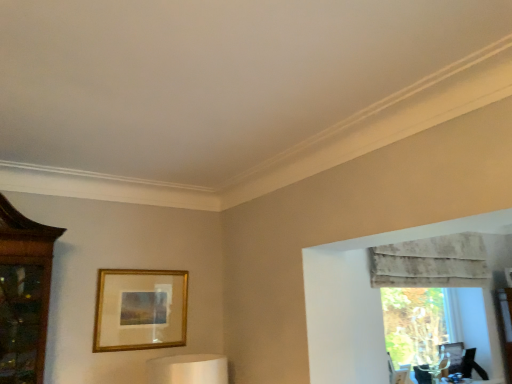
The image size is (512, 384). Describe the element at coordinates (140, 309) in the screenshot. I see `gold metallic picture frame at center` at that location.

The width and height of the screenshot is (512, 384). Describe the element at coordinates (413, 323) in the screenshot. I see `transparent glass vase at right` at that location.

Image resolution: width=512 pixels, height=384 pixels. What do you see at coordinates (431, 262) in the screenshot?
I see `textured beige curtain at upper right` at bounding box center [431, 262].

Locate an element on the screen. This screenshot has width=512, height=384. gold metallic picture frame at center is located at coordinates coord(140,309).

Looking at the image, does gold metallic picture frame at center seem bigger or smaller compared to textured beige curtain at upper right?

Considering their sizes, gold metallic picture frame at center takes up less space than textured beige curtain at upper right.

Looking at this image, is gold metallic picture frame at center aimed at textured beige curtain at upper right?

No, gold metallic picture frame at center is not aimed at textured beige curtain at upper right.

Can you confirm if transparent glass vase at right is positioned to the left of textured beige curtain at upper right?

Yes.

Is transparent glass vase at right turned away from textured beige curtain at upper right?

transparent glass vase at right is not turned away from textured beige curtain at upper right.

Between transparent glass vase at right and textured beige curtain at upper right, which one has more height?

With more height is transparent glass vase at right.

Is point (416, 264) more distant than point (115, 270)?

That is True.

From the image's perspective, is textured beige curtain at upper right beneath gold metallic picture frame at center?

No, from the image's perspective, textured beige curtain at upper right is not below gold metallic picture frame at center.

How many degrees apart are the facing directions of textured beige curtain at upper right and gold metallic picture frame at center?

1.25 degrees.

Considering the sizes of textured beige curtain at upper right and transparent glass vase at right in the image, is textured beige curtain at upper right taller or shorter than transparent glass vase at right?

Clearly, textured beige curtain at upper right is shorter compared to transparent glass vase at right.

Does textured beige curtain at upper right turn towards transparent glass vase at right?

No.

Consider the image. How different are the orientations of textured beige curtain at upper right and transparent glass vase at right in degrees?

The facing directions of textured beige curtain at upper right and transparent glass vase at right are 0.369 degrees apart.

In the scene shown: Considering the relative sizes of textured beige curtain at upper right and transparent glass vase at right in the image provided, is textured beige curtain at upper right smaller than transparent glass vase at right?

No.

Between point (401, 305) and point (181, 320), which one is positioned in front?

The point (181, 320) is closer to the camera.

From a real-world perspective, is transparent glass vase at right under gold metallic picture frame at center?

Yes, from a real-world perspective, transparent glass vase at right is below gold metallic picture frame at center.

Who is shorter, transparent glass vase at right or gold metallic picture frame at center?

gold metallic picture frame at center.

Is transparent glass vase at right touching gold metallic picture frame at center?

transparent glass vase at right and gold metallic picture frame at center are not in contact.

Is gold metallic picture frame at center taller or shorter than transparent glass vase at right?

Clearly, gold metallic picture frame at center is shorter compared to transparent glass vase at right.

What's the angular difference between gold metallic picture frame at center and transparent glass vase at right's facing directions?

gold metallic picture frame at center and transparent glass vase at right are facing 0.877 degrees away from each other.

Is gold metallic picture frame at center positioned in front of transparent glass vase at right?

Yes, it is in front of transparent glass vase at right.

From the picture: Is gold metallic picture frame at center oriented towards transparent glass vase at right?

No, gold metallic picture frame at center is not turned towards transparent glass vase at right.

At what (x,y) coordinates should I click in order to perform the action: click on picture frame located in front of the textured beige curtain at upper right. Please return your answer as a coordinate pair (x, y). Image resolution: width=512 pixels, height=384 pixels. Looking at the image, I should click on point(140,309).

Identify the location of window behind the textured beige curtain at upper right. The height and width of the screenshot is (384, 512). (413, 323).

Based on their spatial positions, is textured beige curtain at upper right or transparent glass vase at right further from gold metallic picture frame at center?

transparent glass vase at right.

Which object lies nearer to the anchor point textured beige curtain at upper right, gold metallic picture frame at center or transparent glass vase at right?

transparent glass vase at right.

Based on their spatial positions, is textured beige curtain at upper right or gold metallic picture frame at center further from transparent glass vase at right?

Among the two, gold metallic picture frame at center is located further to transparent glass vase at right.

Estimate the real-world distances between objects in this image. Which object is closer to textured beige curtain at upper right, transparent glass vase at right or gold metallic picture frame at center?

transparent glass vase at right is positioned closer to the anchor textured beige curtain at upper right.

From the picture: Estimate the real-world distances between objects in this image. Which object is further from gold metallic picture frame at center, transparent glass vase at right or textured beige curtain at upper right?

The object further to gold metallic picture frame at center is transparent glass vase at right.

From the picture: Based on their spatial positions, is gold metallic picture frame at center or textured beige curtain at upper right further from transparent glass vase at right?

gold metallic picture frame at center.

The height and width of the screenshot is (384, 512). I want to click on window between gold metallic picture frame at center and textured beige curtain at upper right, so click(x=413, y=323).